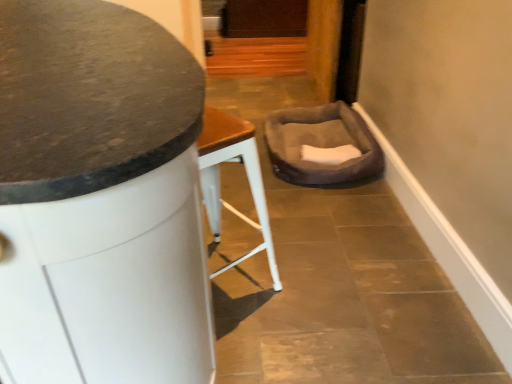
What do you see at coordinates (100, 199) in the screenshot? The width and height of the screenshot is (512, 384). I see `granite countertop at center` at bounding box center [100, 199].

Find the location of a particular element. The height and width of the screenshot is (384, 512). granite countertop at center is located at coordinates (100, 199).

What is the approximate height of brown plush pet bed at center?

It is 7.27 inches.

Identify the location of brown plush pet bed at center. (321, 145).

What do you see at coordinates (321, 145) in the screenshot?
I see `brown plush pet bed at center` at bounding box center [321, 145].

This screenshot has height=384, width=512. Identify the location of granite countertop at center. (100, 199).

Considering the relative positions of brown plush pet bed at center and granite countertop at center in the image provided, is brown plush pet bed at center to the right of granite countertop at center from the viewer's perspective?

Indeed, brown plush pet bed at center is positioned on the right side of granite countertop at center.

Is brown plush pet bed at center positioned in front of granite countertop at center?

No.

Which is more distant, (352, 179) or (197, 343)?

Point (352, 179)

From the image's perspective, is brown plush pet bed at center located beneath granite countertop at center?

Actually, brown plush pet bed at center appears above granite countertop at center in the image.

From a real-world perspective, is brown plush pet bed at center positioned above or below granite countertop at center?

brown plush pet bed at center is below granite countertop at center.

Does brown plush pet bed at center have a greater width compared to granite countertop at center?

No, brown plush pet bed at center is not wider than granite countertop at center.

In terms of height, does brown plush pet bed at center look taller or shorter compared to granite countertop at center?

Clearly, brown plush pet bed at center is shorter compared to granite countertop at center.

Considering the relative sizes of brown plush pet bed at center and granite countertop at center in the image provided, is brown plush pet bed at center smaller than granite countertop at center?

Correct, brown plush pet bed at center occupies less space than granite countertop at center.

Is brown plush pet bed at center positioned beyond the bounds of granite countertop at center?

That's correct, brown plush pet bed at center is outside of granite countertop at center.

Is brown plush pet bed at center far from granite countertop at center?

That's right, there is a large distance between brown plush pet bed at center and granite countertop at center.

Is brown plush pet bed at center looking in the opposite direction of granite countertop at center?

brown plush pet bed at center does not have its back to granite countertop at center.

How different are the orientations of brown plush pet bed at center and granite countertop at center in degrees?

There is a 92.4-degree angle between the facing directions of brown plush pet bed at center and granite countertop at center.

Measure the distance from brown plush pet bed at center to granite countertop at center.

brown plush pet bed at center is 1.62 meters from granite countertop at center.

The width and height of the screenshot is (512, 384). What are the coordinates of `furniture above the brown plush pet bed at center (from a real-world perspective)` in the screenshot? It's located at (100, 199).

Which object is positioned more to the left, granite countertop at center or brown plush pet bed at center?

granite countertop at center is more to the left.

Is granite countertop at center further to the viewer compared to brown plush pet bed at center?

No, granite countertop at center is in front of brown plush pet bed at center.

Which point is more forward, (189, 100) or (271, 119)?

Point (189, 100)

From the image's perspective, between granite countertop at center and brown plush pet bed at center, which one is located above?

brown plush pet bed at center.

From a real-world perspective, is granite countertop at center over brown plush pet bed at center?

Correct, in the physical world, granite countertop at center is higher than brown plush pet bed at center.

Does granite countertop at center have a greater width compared to brown plush pet bed at center?

Indeed, granite countertop at center has a greater width compared to brown plush pet bed at center.

Considering the relative sizes of granite countertop at center and brown plush pet bed at center in the image provided, is granite countertop at center taller than brown plush pet bed at center?

Yes, granite countertop at center is taller than brown plush pet bed at center.

Is granite countertop at center smaller than brown plush pet bed at center?

Actually, granite countertop at center might be larger than brown plush pet bed at center.

Which is correct: granite countertop at center is inside brown plush pet bed at center, or outside of it?

granite countertop at center is not enclosed by brown plush pet bed at center.

Can you see granite countertop at center touching brown plush pet bed at center?

No, granite countertop at center is not touching brown plush pet bed at center.

Is brown plush pet bed at center at the back of granite countertop at center?

No, granite countertop at center is not facing away from brown plush pet bed at center.

Measure the distance between granite countertop at center and brown plush pet bed at center.

granite countertop at center and brown plush pet bed at center are 1.62 meters apart.

Locate an element on the screen. This screenshot has height=384, width=512. furniture on the left of brown plush pet bed at center is located at coordinates (100, 199).

The width and height of the screenshot is (512, 384). What are the coordinates of `swivel chair that appears above the granite countertop at center (from the image's perspective)` in the screenshot? It's located at click(x=321, y=145).

The width and height of the screenshot is (512, 384). In order to click on furniture that is on the left side of brown plush pet bed at center in this screenshot , I will do `click(100, 199)`.